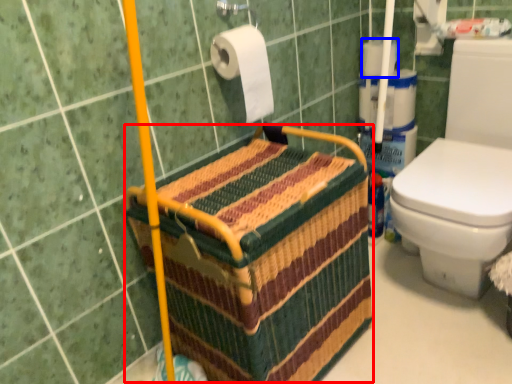
Question: Which object is further to the camera taking this photo, basket (highlighted by a red box) or toilet paper (highlighted by a blue box)?

Choices:
 (A) basket
 (B) toilet paper

Answer: (B)